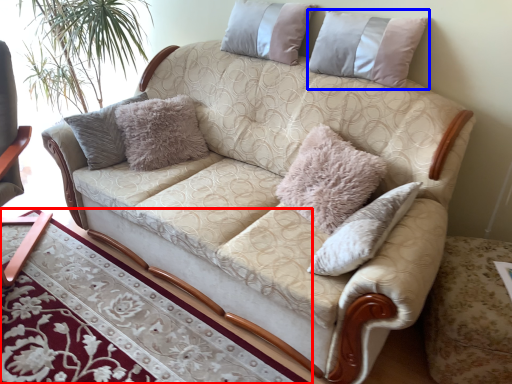
Question: Which of the following is the closest to the observer, table (highlighted by a red box) or pillow (highlighted by a blue box)?

Choices:
 (A) table
 (B) pillow

Answer: (A)